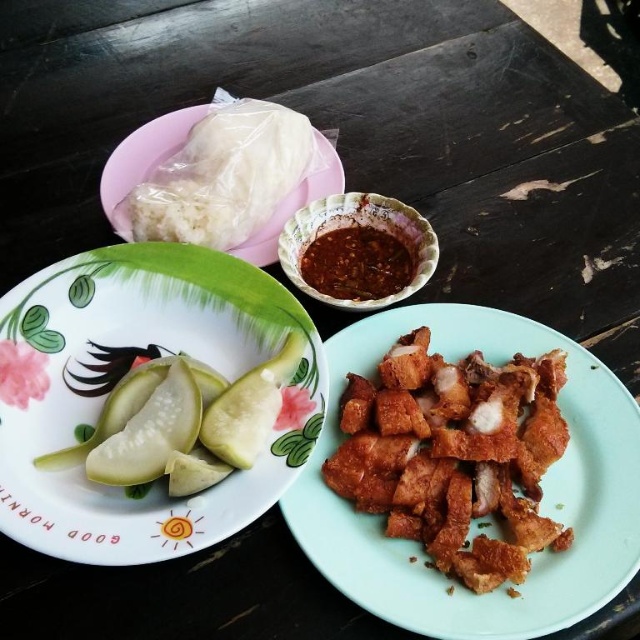
You are holding a 15 cm long chopstick. You want to reach the point at coordinate point (x=250, y=445). Can you reach it with your chopstick?

The point at coordinate point (x=250, y=445) is 73.11 centimeters away from the camera. Since your chopstick is only 15 cm long, you cannot reach that point with your chopstick.

You are a food critic evaluating the height of dishes on a table. You see the golden crispy fried pork at center and the green matte pickles at center. Which dish has a greater height?

The golden crispy fried pork at center is much taller than the green matte pickles at center, so the golden crispy fried pork at center has a greater height.

You are a food critic standing at the edge of the table. You want to describe the dish located at point coordinates (182, 419). What dish is it?

The dish located at point coordinates (182, 419) is the green translucent squash at center.